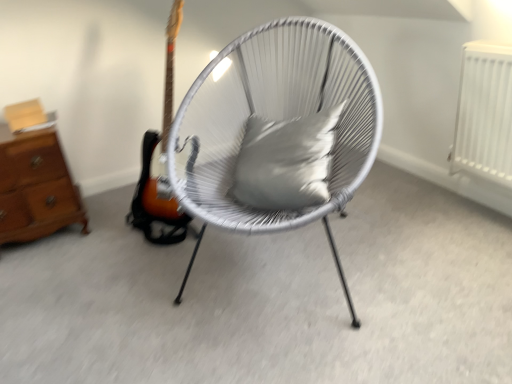
Question: Is brown wooden chest of drawers at left outside white woven chair at center?

Choices:
 (A) no
 (B) yes

Answer: (B)

Question: Is brown wooden chest of drawers at left closer to the viewer compared to white woven chair at center?

Choices:
 (A) no
 (B) yes

Answer: (A)

Question: Is brown wooden chest of drawers at left at the left side of white woven chair at center?

Choices:
 (A) yes
 (B) no

Answer: (A)

Question: Is brown wooden chest of drawers at left in contact with white woven chair at center?

Choices:
 (A) no
 (B) yes

Answer: (A)

Question: Is brown wooden chest of drawers at left at the right side of white woven chair at center?

Choices:
 (A) yes
 (B) no

Answer: (B)

Question: Considering the positions of satin gray pillow at center and brown wooden chest of drawers at left in the image, is satin gray pillow at center taller or shorter than brown wooden chest of drawers at left?

Choices:
 (A) short
 (B) tall

Answer: (A)

Question: Is point (261, 163) closer or farther from the camera than point (61, 187)?

Choices:
 (A) closer
 (B) farther

Answer: (A)

Question: Looking at the image, does satin gray pillow at center seem bigger or smaller compared to brown wooden chest of drawers at left?

Choices:
 (A) small
 (B) big

Answer: (A)

Question: Considering the positions of satin gray pillow at center and brown wooden chest of drawers at left in the image, is satin gray pillow at center wider or thinner than brown wooden chest of drawers at left?

Choices:
 (A) thin
 (B) wide

Answer: (A)

Question: Considering the positions of point (46, 177) and point (345, 145), is point (46, 177) closer or farther from the camera than point (345, 145)?

Choices:
 (A) closer
 (B) farther

Answer: (B)

Question: Is brown wooden chest of drawers at left taller or shorter than white woven chair at center?

Choices:
 (A) tall
 (B) short

Answer: (B)

Question: Looking at their shapes, would you say brown wooden chest of drawers at left is wider or thinner than white woven chair at center?

Choices:
 (A) wide
 (B) thin

Answer: (B)

Question: From a real-world perspective, is brown wooden chest of drawers at left positioned above or below white woven chair at center?

Choices:
 (A) above
 (B) below

Answer: (B)

Question: Does point (55, 230) appear closer or farther from the camera than point (325, 182)?

Choices:
 (A) farther
 (B) closer

Answer: (A)

Question: Considering the positions of brown wooden chest of drawers at left and satin gray pillow at center in the image, is brown wooden chest of drawers at left wider or thinner than satin gray pillow at center?

Choices:
 (A) wide
 (B) thin

Answer: (A)